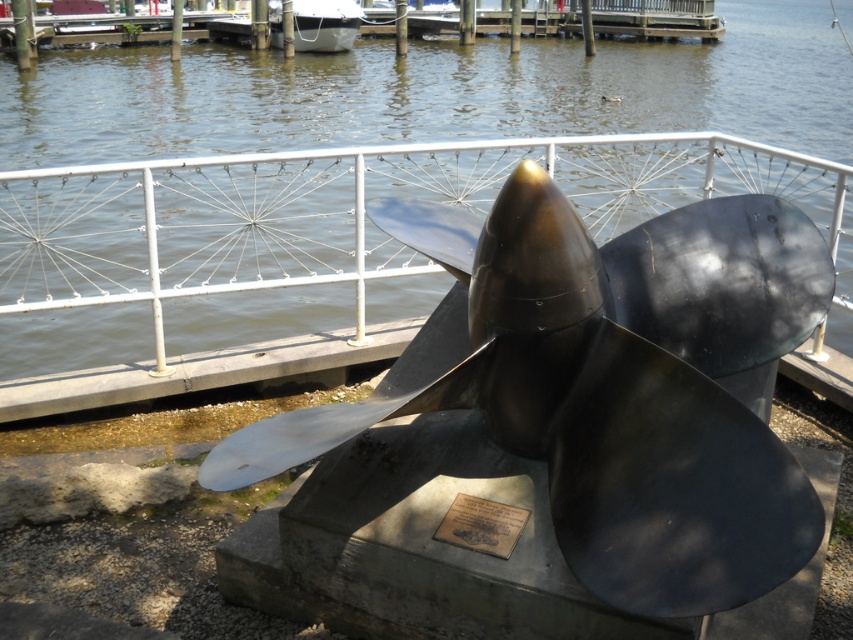
Measure the distance between point [680,355] and camera.

2.66 meters

Can you confirm if polished bronze propeller at center is positioned to the right of bronze plaque at center?

Yes, polished bronze propeller at center is to the right of bronze plaque at center.

Is point (541, 529) in front of point (456, 520)?

Yes, it is in front of point (456, 520).

Identify the location of polished bronze propeller at center. (566, 428).

Is metallic water at center closer to the viewer compared to bronze plaque at center?

No, it is behind bronze plaque at center.

Which of these two, metallic water at center or bronze plaque at center, stands taller?

metallic water at center is taller.

Image resolution: width=853 pixels, height=640 pixels. What are the coordinates of `metallic water at center` in the screenshot? It's located at (434, 93).

Is point (328, 435) farther from camera compared to point (807, 33)?

No.

Between point (550, 253) and point (90, 132), which one is positioned in front?

Positioned in front is point (550, 253).

This screenshot has width=853, height=640. Find the location of `polished bronze propeller at center`. polished bronze propeller at center is located at coordinates (566, 428).